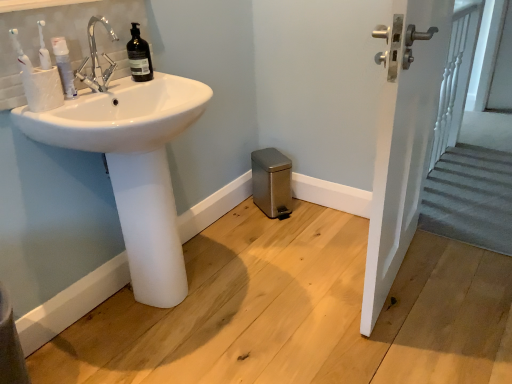
This screenshot has height=384, width=512. I want to click on free location in front of satin silver trash can at lower center, so pos(273,226).